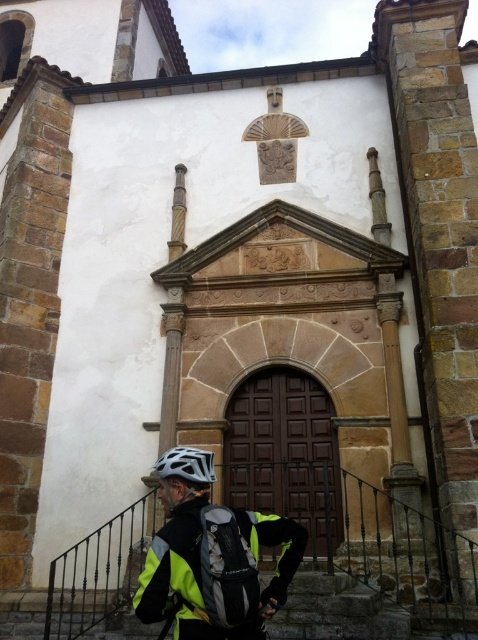
Question: Is yellow reflective jacket at lower center thinner than white matte bicycle helmet at lower center?

Choices:
 (A) no
 (B) yes

Answer: (A)

Question: Which of the following is the closest to the observer?

Choices:
 (A) (207, 544)
 (B) (198, 468)

Answer: (A)

Question: Can you confirm if yellow reflective jacket at lower center is positioned above white matte bicycle helmet at lower center?

Choices:
 (A) no
 (B) yes

Answer: (A)

Question: Which of the following is the closest to the observer?

Choices:
 (A) white matte bicycle helmet at lower center
 (B) yellow reflective jacket at lower center

Answer: (B)

Question: Which point is farther to the camera?

Choices:
 (A) white matte bicycle helmet at lower center
 (B) yellow reflective jacket at lower center

Answer: (A)

Question: Is yellow reflective jacket at lower center above white matte bicycle helmet at lower center?

Choices:
 (A) yes
 (B) no

Answer: (B)